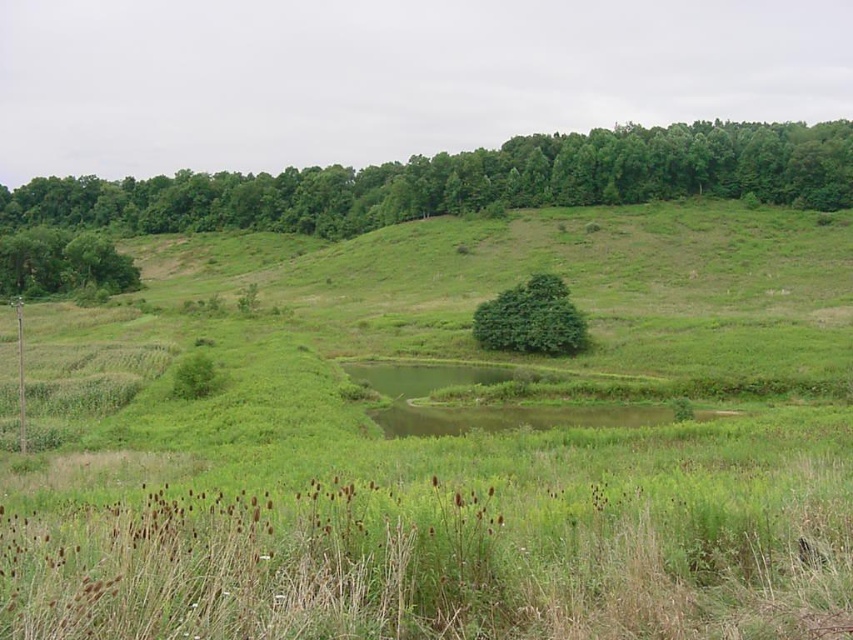
In the scene shown: You are standing in the serene rural landscape and want to walk from the green leafy tree at upper center to the green leafy tree at center. Which direction should you move relative to the tree you are currently at?

To move from the green leafy tree at upper center to the green leafy tree at center, you should move to the right since the green leafy tree at upper center is positioned on the left side of the green leafy tree at center.

You are standing in the rural landscape and want to find the larger tree to rest under. Which tree should you choose between the green leafy tree at upper center and the green leafy tree at center?

The green leafy tree at upper center is bigger than the green leafy tree at center, so you should choose the green leafy tree at upper center to rest under.